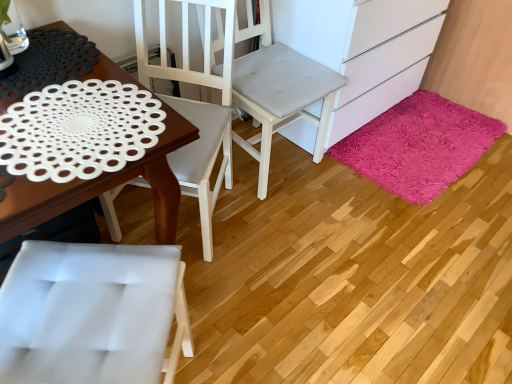
Question: Considering the relative sizes of shaggy pink rug at lower right and white matte doily at left in the image provided, is shaggy pink rug at lower right bigger than white matte doily at left?

Choices:
 (A) no
 (B) yes

Answer: (A)

Question: Is the depth of shaggy pink rug at lower right greater than that of white matte doily at left?

Choices:
 (A) yes
 (B) no

Answer: (A)

Question: Is shaggy pink rug at lower right thinner than white matte doily at left?

Choices:
 (A) yes
 (B) no

Answer: (A)

Question: From a real-world perspective, is shaggy pink rug at lower right positioned under white matte doily at left based on gravity?

Choices:
 (A) yes
 (B) no

Answer: (A)

Question: Is shaggy pink rug at lower right positioned beyond the bounds of white matte doily at left?

Choices:
 (A) no
 (B) yes

Answer: (B)

Question: From a real-world perspective, is white matte doily at left positioned above or below shaggy pink rug at lower right?

Choices:
 (A) above
 (B) below

Answer: (A)

Question: Does point (2, 228) appear closer or farther from the camera than point (426, 177)?

Choices:
 (A) closer
 (B) farther

Answer: (A)

Question: Considering the positions of white matte doily at left and shaggy pink rug at lower right in the image, is white matte doily at left taller or shorter than shaggy pink rug at lower right?

Choices:
 (A) tall
 (B) short

Answer: (A)

Question: Would you say white matte doily at left is to the left or to the right of shaggy pink rug at lower right in the picture?

Choices:
 (A) right
 (B) left

Answer: (B)

Question: From the image's perspective, is shaggy pink rug at lower right above or below white matte doily at left?

Choices:
 (A) above
 (B) below

Answer: (A)

Question: Considering the positions of shaggy pink rug at lower right and white matte doily at left in the image, is shaggy pink rug at lower right taller or shorter than white matte doily at left?

Choices:
 (A) tall
 (B) short

Answer: (B)

Question: Considering their positions, is shaggy pink rug at lower right located in front of or behind white matte doily at left?

Choices:
 (A) behind
 (B) front

Answer: (A)

Question: Is shaggy pink rug at lower right bigger or smaller than white matte doily at left?

Choices:
 (A) big
 (B) small

Answer: (B)

Question: From the image's perspective, relative to white matte cabinet at lower right, is shaggy pink rug at lower right above or below?

Choices:
 (A) below
 (B) above

Answer: (A)

Question: From a real-world perspective, is shaggy pink rug at lower right above or below white matte cabinet at lower right?

Choices:
 (A) below
 (B) above

Answer: (A)